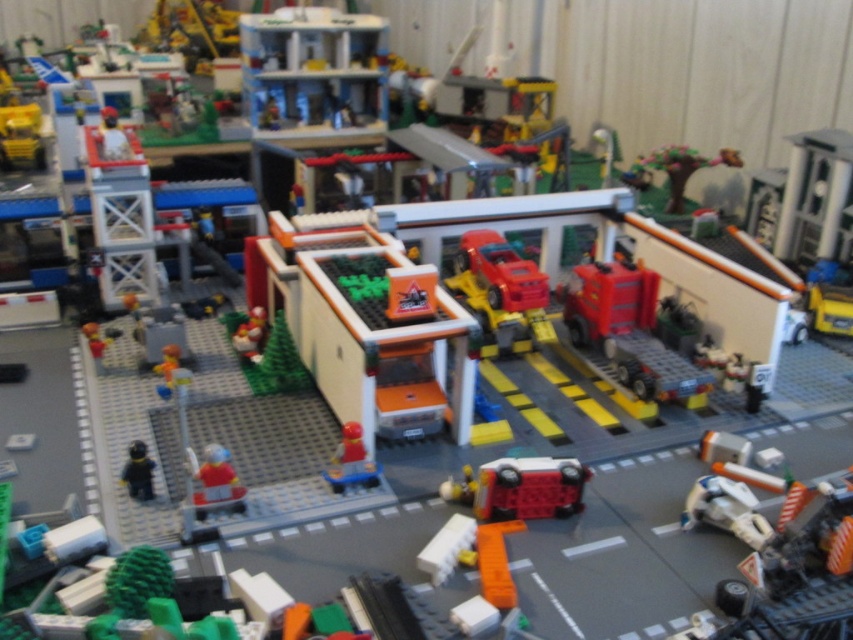
Question: Which object is the closest to the white plastic car at center?

Choices:
 (A) black plastic minifigure at lower left
 (B) smooth plastic minifigure at center
 (C) bright red plastic figure at center

Answer: (C)

Question: Does white plastic car at center have a greater width compared to black plastic minifigure at lower left?

Choices:
 (A) no
 (B) yes

Answer: (B)

Question: Which object is the closest to the smooth red figure at center?

Choices:
 (A) black plastic minifigure at lower left
 (B) orange matte truck at center
 (C) smooth plastic minifigure at center
 (D) white plastic car at center

Answer: (A)

Question: Is orange matte truck at center smaller than white plastic car at center?

Choices:
 (A) no
 (B) yes

Answer: (A)

Question: Does bright red plastic figure at center have a smaller size compared to black plastic minifigure at lower left?

Choices:
 (A) yes
 (B) no

Answer: (B)

Question: Which of these objects is positioned closest to the smooth plastic minifigure at center?

Choices:
 (A) white plastic car at center
 (B) orange matte truck at center
 (C) bright red plastic figure at center
 (D) black plastic minifigure at lower left

Answer: (B)